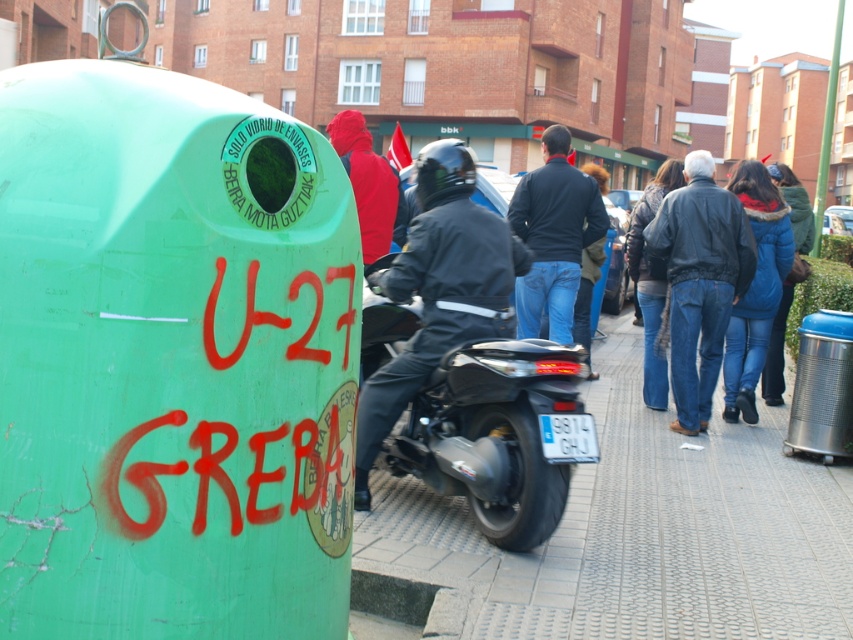
Is smooth concrete pavement at center above dark blue jacket at center?

No.

Which of these two, smooth concrete pavement at center or dark blue jacket at center, stands shorter?

smooth concrete pavement at center is shorter.

The height and width of the screenshot is (640, 853). Find the location of `smooth concrete pavement at center`. smooth concrete pavement at center is located at coordinates (645, 531).

Does dark blue jeans at center come behind denim jacket at right?

No, it is not.

Who is more distant from viewer, (688, 220) or (635, 289)?

The point (635, 289) is more distant.

Image resolution: width=853 pixels, height=640 pixels. I want to click on dark blue jeans at center, so click(x=699, y=280).

Between red fabric jacket at center and blue puffy coat at center, which one is positioned lower?

blue puffy coat at center

Can you confirm if red fabric jacket at center is positioned to the right of blue puffy coat at center?

In fact, red fabric jacket at center is to the left of blue puffy coat at center.

What do you see at coordinates (366, 182) in the screenshot? I see `red fabric jacket at center` at bounding box center [366, 182].

Image resolution: width=853 pixels, height=640 pixels. In order to click on red fabric jacket at center in this screenshot , I will do `click(366, 182)`.